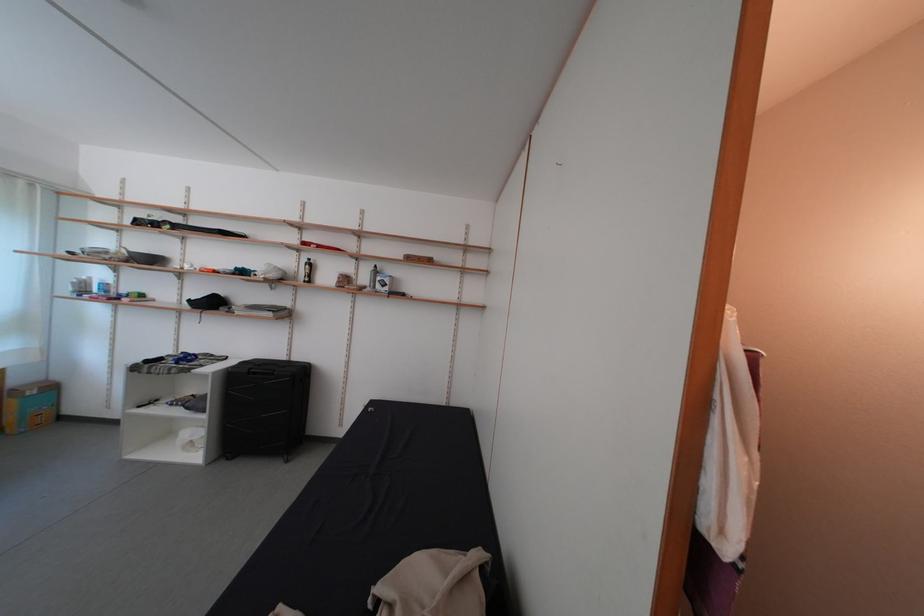
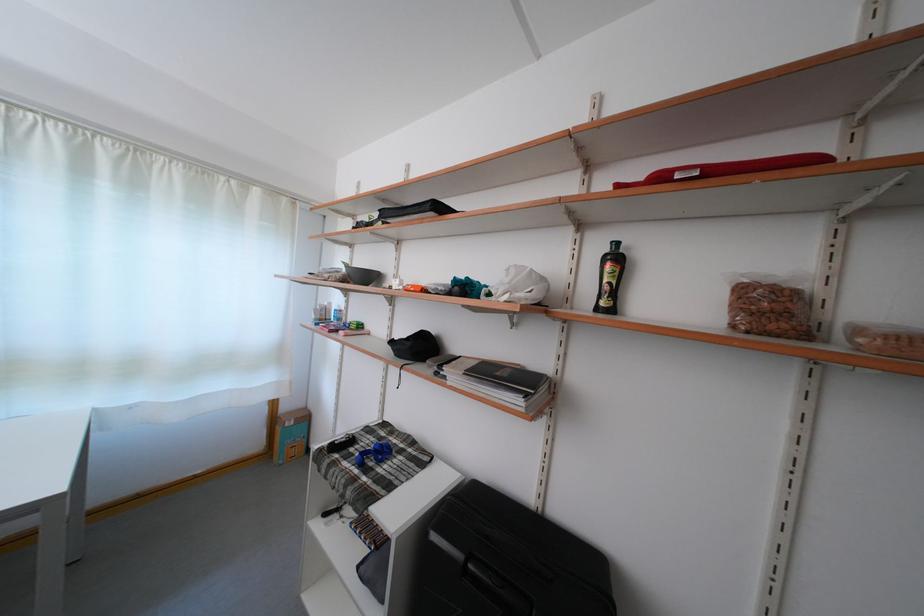
Find the pixel in the second image that matches (x=119, y=390) in the first image.

(344, 436)